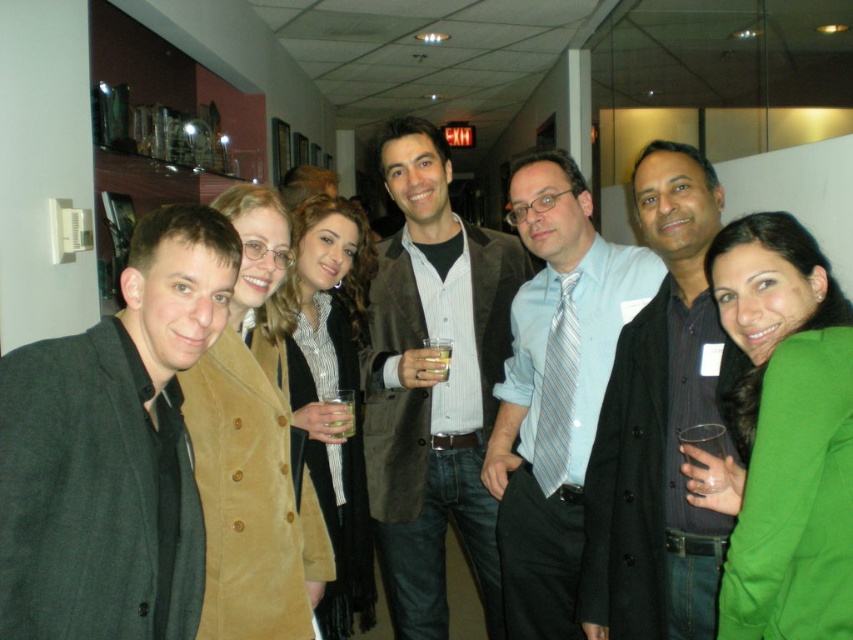
Is brown textured blazer at center to the left of green matte blazer at center from the viewer's perspective?

Indeed, brown textured blazer at center is positioned on the left side of green matte blazer at center.

Who is higher up, brown textured blazer at center or green matte blazer at center?

green matte blazer at center is higher up.

The width and height of the screenshot is (853, 640). What are the coordinates of `brown textured blazer at center` in the screenshot? It's located at (433, 385).

The height and width of the screenshot is (640, 853). I want to click on green matte blazer at center, so click(786, 433).

Is green matte blazer at center above translucent plastic cup at center?

Yes, green matte blazer at center is above translucent plastic cup at center.

Which is in front, point (757, 342) or point (351, 433)?

Point (757, 342) is in front.

This screenshot has width=853, height=640. Find the location of `green matte blazer at center`. green matte blazer at center is located at coordinates (786, 433).

Can you confirm if dark gray wool jacket at left is positioned to the right of dark gray coat at center?

Incorrect, dark gray wool jacket at left is not on the right side of dark gray coat at center.

Does dark gray wool jacket at left appear under dark gray coat at center?

Actually, dark gray wool jacket at left is above dark gray coat at center.

Is point (3, 520) behind point (590, 572)?

No.

Find the location of a particular element. The height and width of the screenshot is (640, 853). dark gray wool jacket at left is located at coordinates (113, 449).